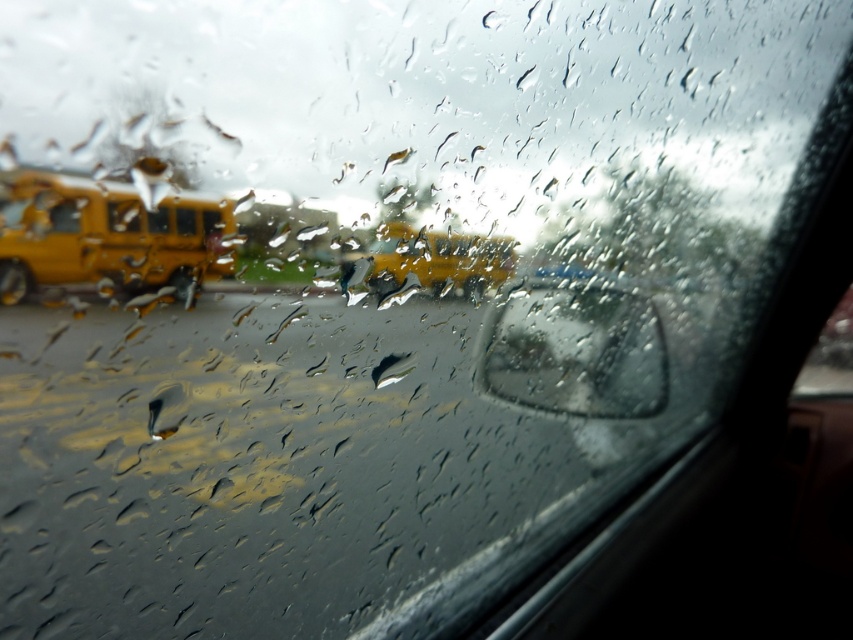
Question: Does transparent glass window at center have a lesser width compared to yellow matte bus at left?

Choices:
 (A) no
 (B) yes

Answer: (B)

Question: Does transparent glass window at center come behind yellow matte bus at left?

Choices:
 (A) yes
 (B) no

Answer: (A)

Question: Is transparent glass mirror at center above yellow matte bus at center?

Choices:
 (A) yes
 (B) no

Answer: (B)

Question: Among these objects, which one is farthest from the camera?

Choices:
 (A) transparent glass mirror at center
 (B) yellow matte bus at center

Answer: (A)

Question: Which point is farther to the camera?

Choices:
 (A) (437, 257)
 (B) (152, 221)
 (C) (587, 417)

Answer: (C)

Question: Which is nearer to the matte yellow bus at left?

Choices:
 (A) yellow matte bus at center
 (B) yellow matte bus at left

Answer: (B)